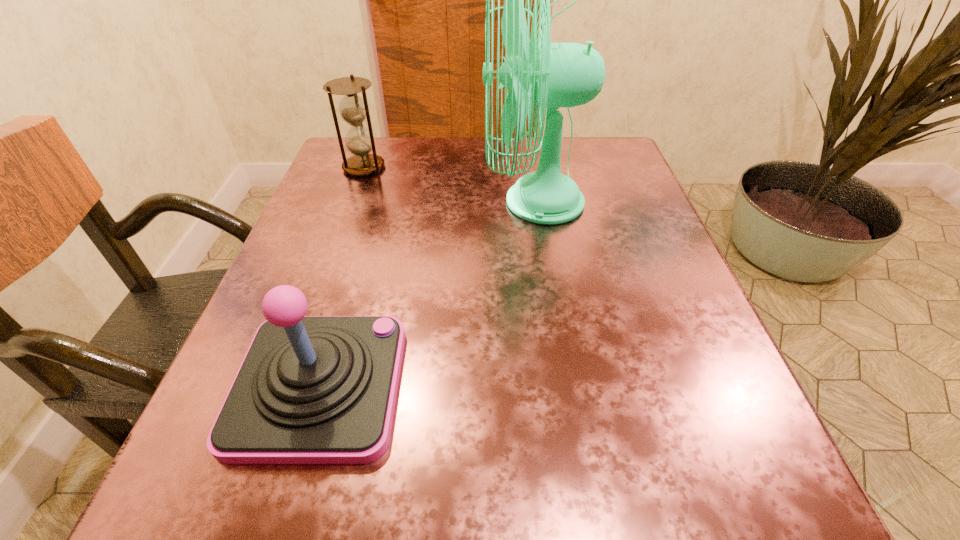
Where is `vacant area that lies between the joystick and the fan`? vacant area that lies between the joystick and the fan is located at coordinates (426, 294).

The width and height of the screenshot is (960, 540). I want to click on empty space that is in between the hourglass and the fan, so coord(448,185).

Image resolution: width=960 pixels, height=540 pixels. I want to click on free space between the joystick and the fan, so click(426, 294).

Find the location of a particular element. The width and height of the screenshot is (960, 540). object that ranks as the second closest to the hourglass is located at coordinates (311, 389).

Locate an element on the screen. The height and width of the screenshot is (540, 960). object that ranks as the closest to the joystick is located at coordinates (551, 75).